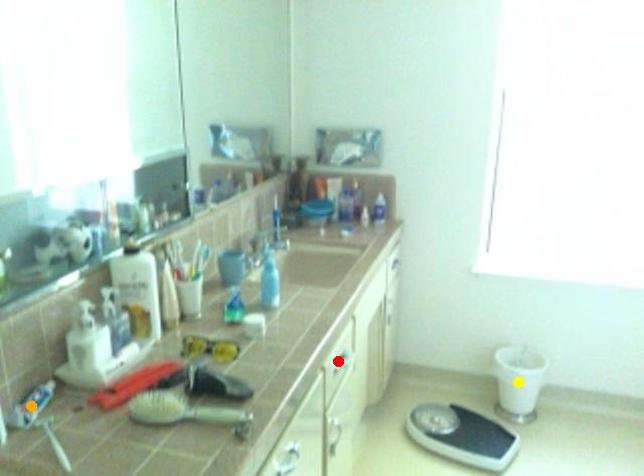
Order these from nearest to farthest:
red point
yellow point
orange point

orange point
red point
yellow point